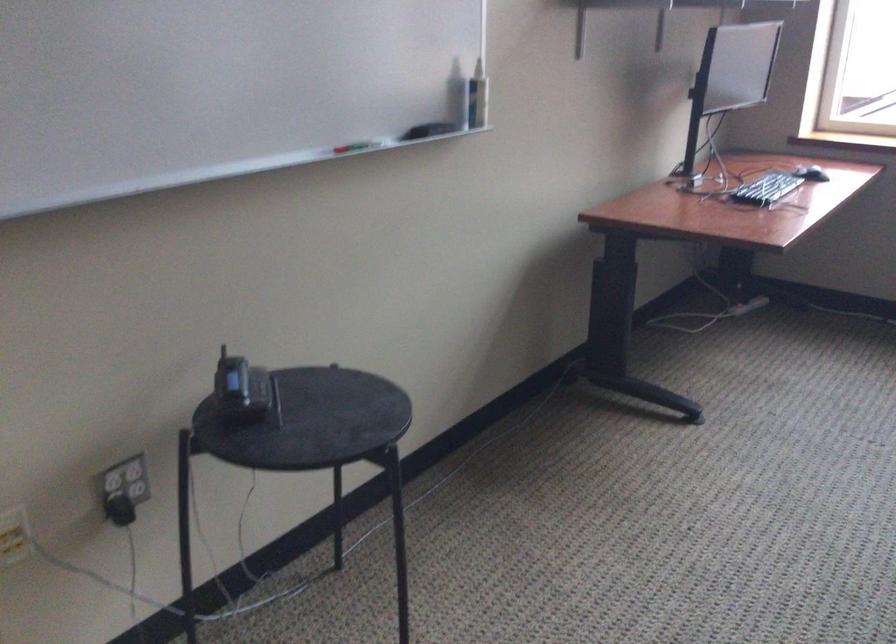
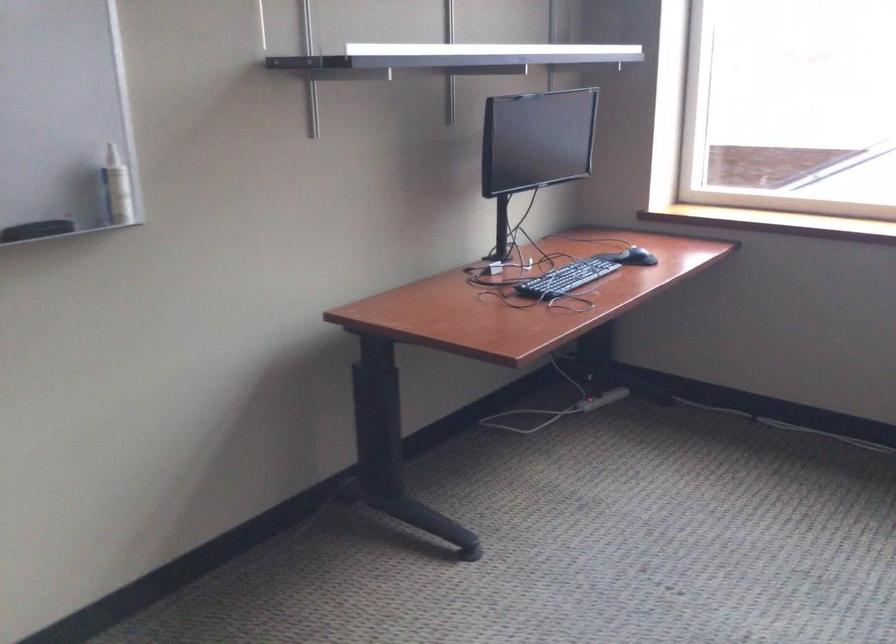
The point at (821, 162) is marked in the first image. Where is the corresponding point in the second image?

(636, 257)